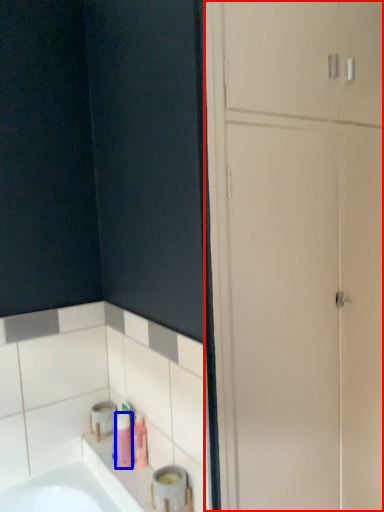
Question: Which point is closer to the camera, dresser (highlighted by a red box) or toiletry (highlighted by a blue box)?

Choices:
 (A) dresser
 (B) toiletry

Answer: (A)